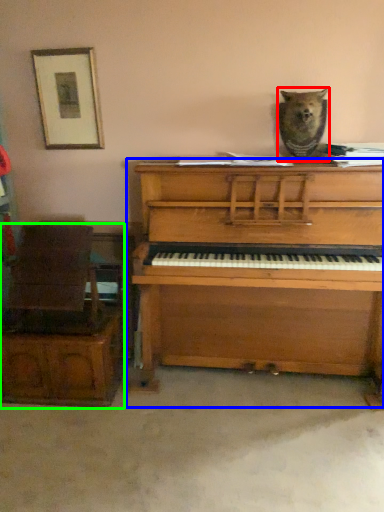
Question: Considering the real-world distances, which object is closest to animal (highlighted by a red box)? piano (highlighted by a blue box) or furniture (highlighted by a green box).

Choices:
 (A) piano
 (B) furniture

Answer: (A)